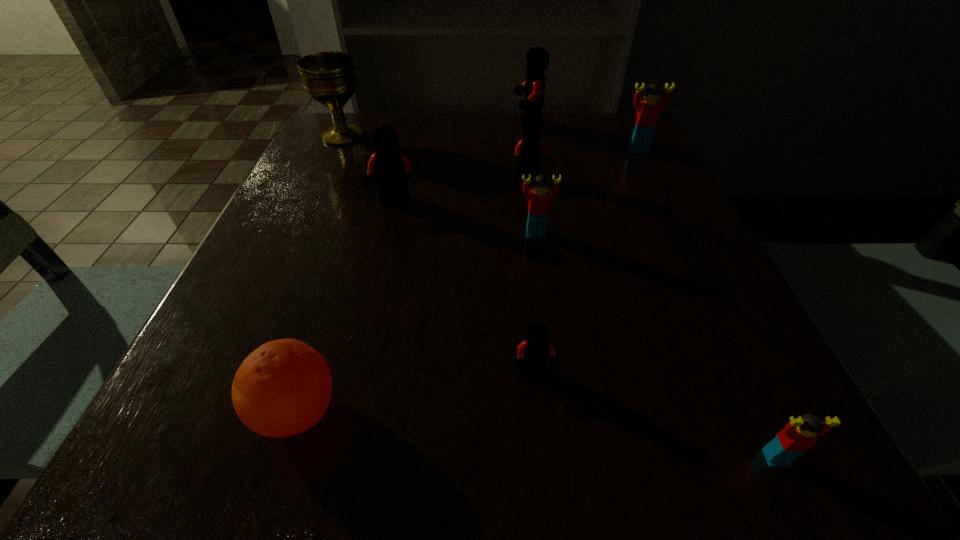
I want to click on Lego that is the sixth closest to the tallest Lego, so click(x=798, y=436).

The height and width of the screenshot is (540, 960). I want to click on the closest Lego to the orange orange, so click(534, 352).

Point out which black Lego is positioned as the nearest to the tallest Lego. Please provide its 2D coordinates. Your answer should be formatted as a tuple, i.e. [(x, y)], where the tuple contains the x and y coordinates of a point satisfying the conditions above.

[(529, 150)]

Identify which black Lego is the second nearest to the leftmost Lego. Please provide its 2D coordinates. Your answer should be formatted as a tuple, i.e. [(x, y)], where the tuple contains the x and y coordinates of a point satisfying the conditions above.

[(537, 58)]

Choose which red Lego is the second nearest neighbor to the farthest Lego. Please provide its 2D coordinates. Your answer should be formatted as a tuple, i.e. [(x, y)], where the tuple contains the x and y coordinates of a point satisfying the conditions above.

[(539, 197)]

Find the location of a particular element. This screenshot has height=540, width=960. the second closest red Lego to the farthest black Lego is located at coordinates (539, 197).